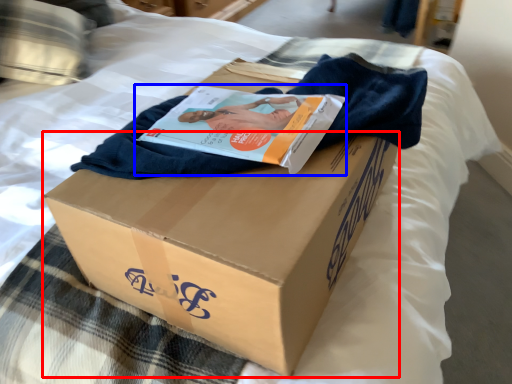
Question: Which point is further to the camera, cardboard box (highlighted by a red box) or magazine (highlighted by a blue box)?

Choices:
 (A) cardboard box
 (B) magazine

Answer: (B)